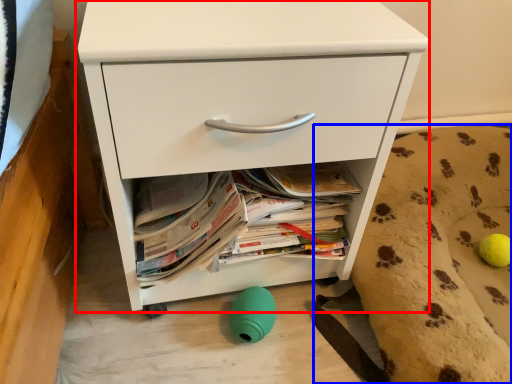
Question: Which of the following is the farthest to the observer, chest of drawers (highlighted by a red box) or dog bed (highlighted by a blue box)?

Choices:
 (A) chest of drawers
 (B) dog bed

Answer: (B)